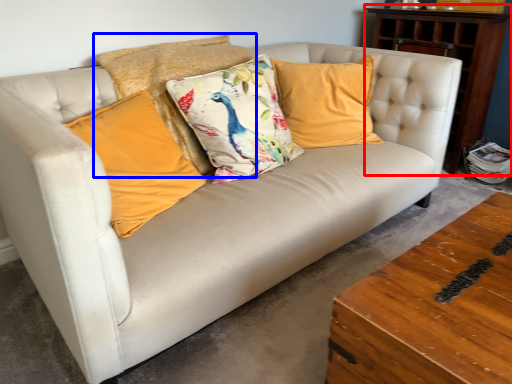
Question: Which point is further to the camera, dresser (highlighted by a red box) or pillow (highlighted by a blue box)?

Choices:
 (A) dresser
 (B) pillow

Answer: (A)